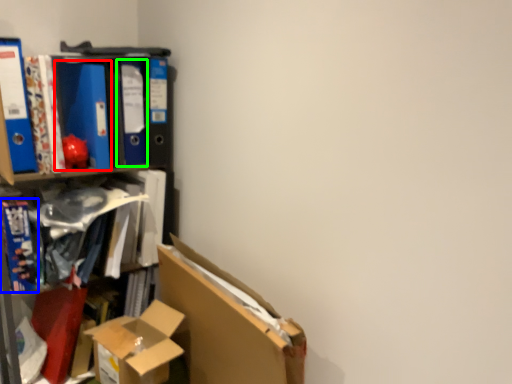
Question: Which object is the closest to the paperback book (highlighted by a red box)? Choose among these: book (highlighted by a blue box) or paperback book (highlighted by a green box).

Choices:
 (A) book
 (B) paperback book

Answer: (B)